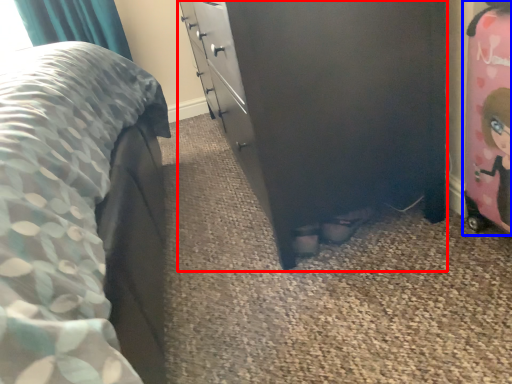
Question: Which object appears farthest to the camera in this image, chest of drawers (highlighted by a red box) or toy (highlighted by a blue box)?

Choices:
 (A) chest of drawers
 (B) toy

Answer: (A)